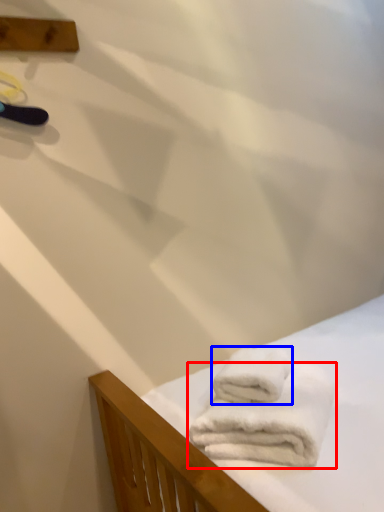
Question: Which of the following is the farthest to the observer, towel (highlighted by a red box) or towel (highlighted by a blue box)?

Choices:
 (A) towel
 (B) towel

Answer: (B)